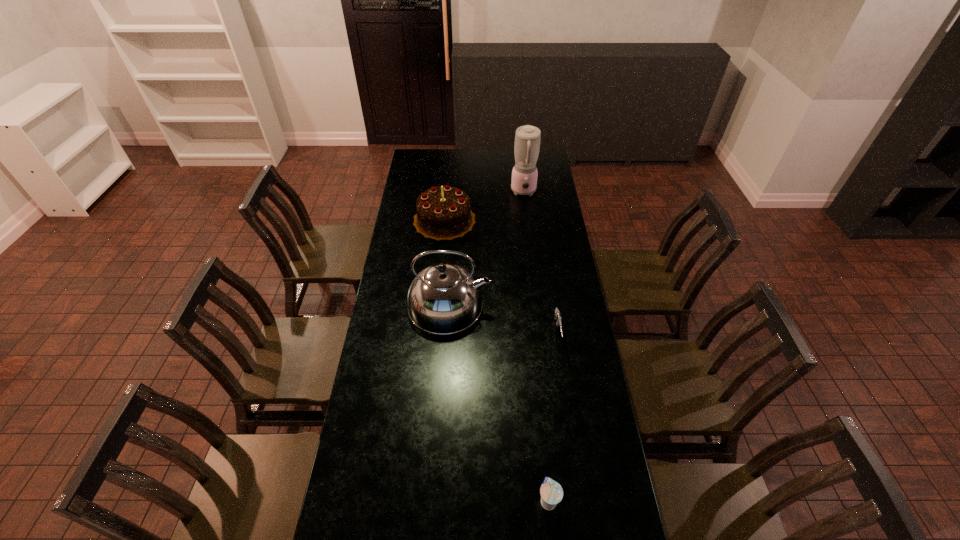
Locate an element on the screen. free space between the kettle and the food processor is located at coordinates (487, 248).

Locate an element on the screen. The width and height of the screenshot is (960, 540). vacant area that lies between the food processor and the birthday cake is located at coordinates (484, 206).

Where is `vacant area between the nearest object and the tallest object`? The width and height of the screenshot is (960, 540). vacant area between the nearest object and the tallest object is located at coordinates (536, 346).

Where is `vacant area that lies between the gun and the third shortest object`? vacant area that lies between the gun and the third shortest object is located at coordinates (501, 276).

Where is `free space that is in between the gun and the third shortest object`? The image size is (960, 540). free space that is in between the gun and the third shortest object is located at coordinates (501, 276).

The height and width of the screenshot is (540, 960). Identify the location of unoccupied area between the kettle and the nearest object. (498, 403).

I want to click on free area in between the food processor and the third shortest object, so click(484, 206).

Where is `vacant area between the gun and the third tallest object`? This screenshot has height=540, width=960. vacant area between the gun and the third tallest object is located at coordinates (501, 276).

At what (x,y) coordinates should I click in order to perform the action: click on object that is the second closest to the food processor. Please return your answer as a coordinate pair (x, y). Image resolution: width=960 pixels, height=540 pixels. Looking at the image, I should click on (444, 298).

Find the location of `the second closest object relative to the birthday cake`. the second closest object relative to the birthday cake is located at coordinates (444, 298).